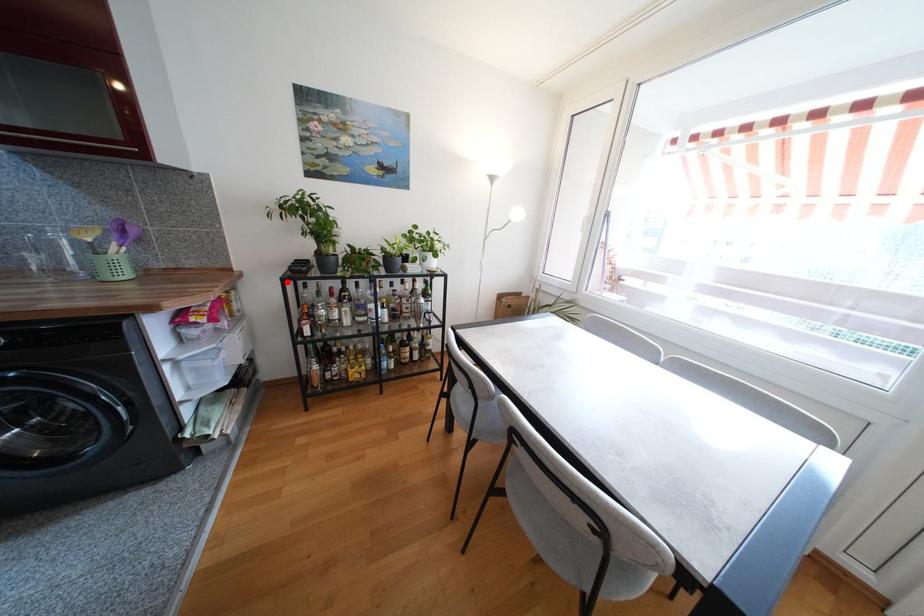
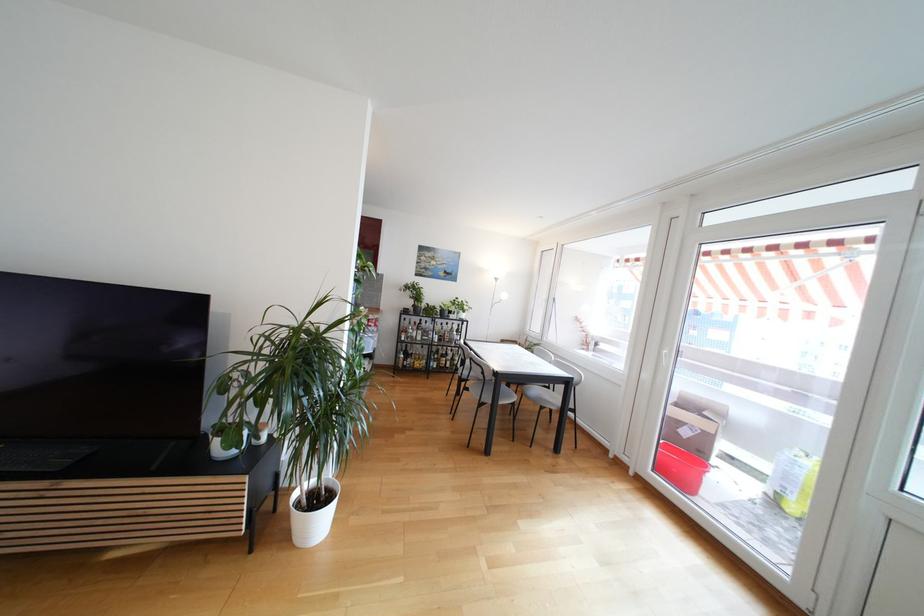
In the second image, find the point that corresponds to the highlighted location in the first image.

(405, 315)